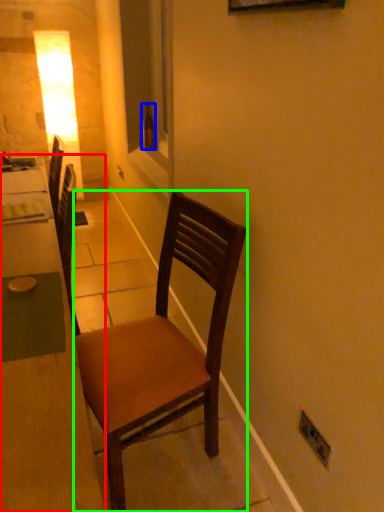
Question: Which object is positioned closest to desk (highlighted by a red box)? Select from bottle (highlighted by a blue box) and chair (highlighted by a green box).

Choices:
 (A) bottle
 (B) chair

Answer: (B)